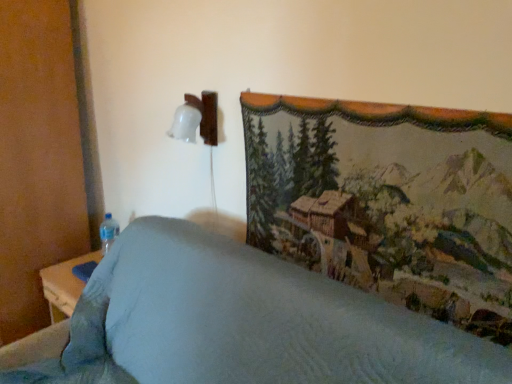
Question: Is textured fabric bedspread at center inside the boundaries of textured tapestry at upper right, or outside?

Choices:
 (A) inside
 (B) outside

Answer: (B)

Question: Relative to textured tapestry at upper right, is textured fabric bedspread at center in front or behind?

Choices:
 (A) behind
 (B) front

Answer: (B)

Question: Based on their relative distances, which object is nearer to the textured tapestry at upper right?

Choices:
 (A) textured fabric bedspread at center
 (B) transparent plastic bottle at lower left

Answer: (A)

Question: Which object is the farthest from the textured fabric bedspread at center?

Choices:
 (A) transparent plastic bottle at lower left
 (B) textured tapestry at upper right

Answer: (A)